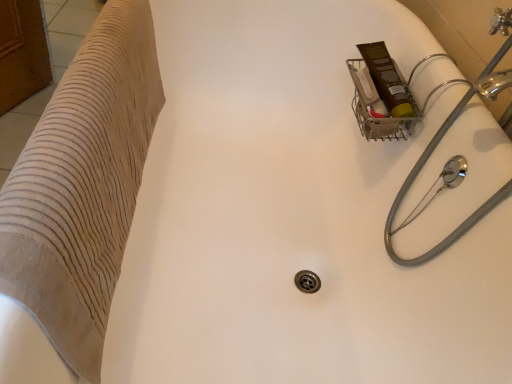
Question: From a real-world perspective, is gray rubber hose at upper right physically located above or below beige textured towel at left?

Choices:
 (A) below
 (B) above

Answer: (B)

Question: Considering the relative positions of gray rubber hose at upper right and beige textured towel at left in the image provided, is gray rubber hose at upper right to the left or to the right of beige textured towel at left?

Choices:
 (A) right
 (B) left

Answer: (A)

Question: Considering the positions of point (394, 259) and point (54, 249), is point (394, 259) closer or farther from the camera than point (54, 249)?

Choices:
 (A) closer
 (B) farther

Answer: (B)

Question: Is beige textured towel at left to the left or to the right of gray rubber hose at upper right in the image?

Choices:
 (A) left
 (B) right

Answer: (A)

Question: Is point (77, 168) closer or farther from the camera than point (454, 241)?

Choices:
 (A) farther
 (B) closer

Answer: (B)

Question: Relative to gray rubber hose at upper right, is beige textured towel at left in front or behind?

Choices:
 (A) front
 (B) behind

Answer: (A)

Question: From a real-world perspective, relative to gray rubber hose at upper right, is beige textured towel at left vertically above or below?

Choices:
 (A) below
 (B) above

Answer: (A)